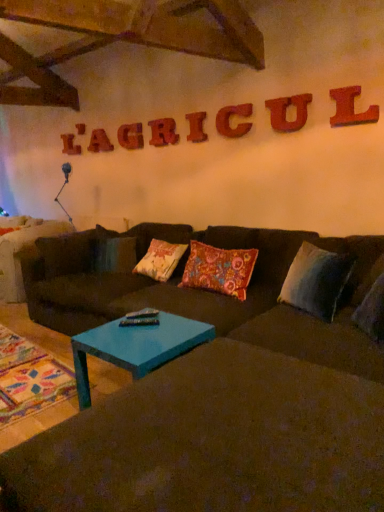
Question: Is floral-patterned fabric pillow at center, the 1th pillow when ordered from left to right, at the right side of gray fabric pillow at right, the first pillow when ordered from right to left?

Choices:
 (A) yes
 (B) no

Answer: (B)

Question: Is the position of floral-patterned fabric pillow at center, which appears as the second pillow when viewed from the right, more distant than that of gray fabric pillow at right, which appears as the 2th pillow when viewed from the left?

Choices:
 (A) no
 (B) yes

Answer: (B)

Question: Is floral-patterned fabric pillow at center, which appears as the second pillow when viewed from the right, beside gray fabric pillow at right, which appears as the 2th pillow when viewed from the left?

Choices:
 (A) yes
 (B) no

Answer: (B)

Question: Is floral-patterned fabric pillow at center, which appears as the second pillow when viewed from the right, at the left side of gray fabric pillow at right, the first pillow when ordered from right to left?

Choices:
 (A) no
 (B) yes

Answer: (B)

Question: Is floral-patterned fabric pillow at center, which appears as the second pillow when viewed from the right, oriented away from gray fabric pillow at right, which appears as the 2th pillow when viewed from the left?

Choices:
 (A) yes
 (B) no

Answer: (B)

Question: Is floral-patterned fabric pillow at center, the 1th pillow when ordered from left to right, taller or shorter than dark brown fabric couch at center?

Choices:
 (A) tall
 (B) short

Answer: (B)

Question: Based on their sizes in the image, would you say floral-patterned fabric pillow at center, the 1th pillow when ordered from left to right, is bigger or smaller than dark brown fabric couch at center?

Choices:
 (A) small
 (B) big

Answer: (A)

Question: From the image's perspective, is floral-patterned fabric pillow at center, which appears as the second pillow when viewed from the right, located above or below dark brown fabric couch at center?

Choices:
 (A) below
 (B) above

Answer: (B)

Question: Choose the correct answer: Is floral-patterned fabric pillow at center, the 1th pillow when ordered from left to right, inside dark brown fabric couch at center or outside it?

Choices:
 (A) outside
 (B) inside

Answer: (B)

Question: Considering their positions, is dark brown fabric couch at center located in front of or behind teal glossy coffee table at center?

Choices:
 (A) behind
 (B) front

Answer: (B)

Question: Which is correct: dark brown fabric couch at center is inside teal glossy coffee table at center, or outside of it?

Choices:
 (A) inside
 (B) outside

Answer: (B)

Question: From a real-world perspective, is dark brown fabric couch at center physically located above or below teal glossy coffee table at center?

Choices:
 (A) below
 (B) above

Answer: (B)

Question: Considering the positions of dark brown fabric couch at center and teal glossy coffee table at center in the image, is dark brown fabric couch at center taller or shorter than teal glossy coffee table at center?

Choices:
 (A) short
 (B) tall

Answer: (B)

Question: Does point (155, 347) appear closer or farther from the camera than point (188, 468)?

Choices:
 (A) closer
 (B) farther

Answer: (B)

Question: From a real-world perspective, is teal glossy coffee table at center above or below dark brown fabric couch at center?

Choices:
 (A) below
 (B) above

Answer: (A)